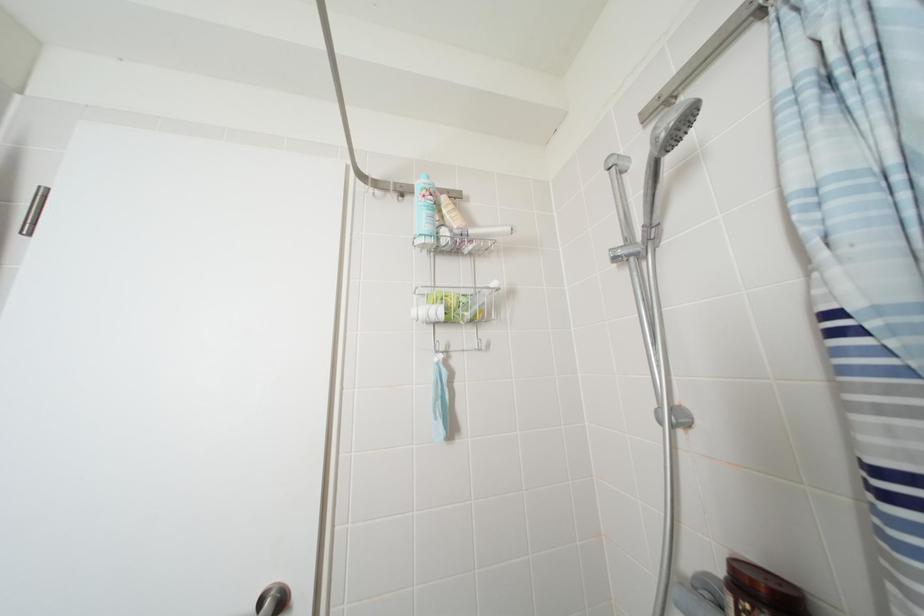
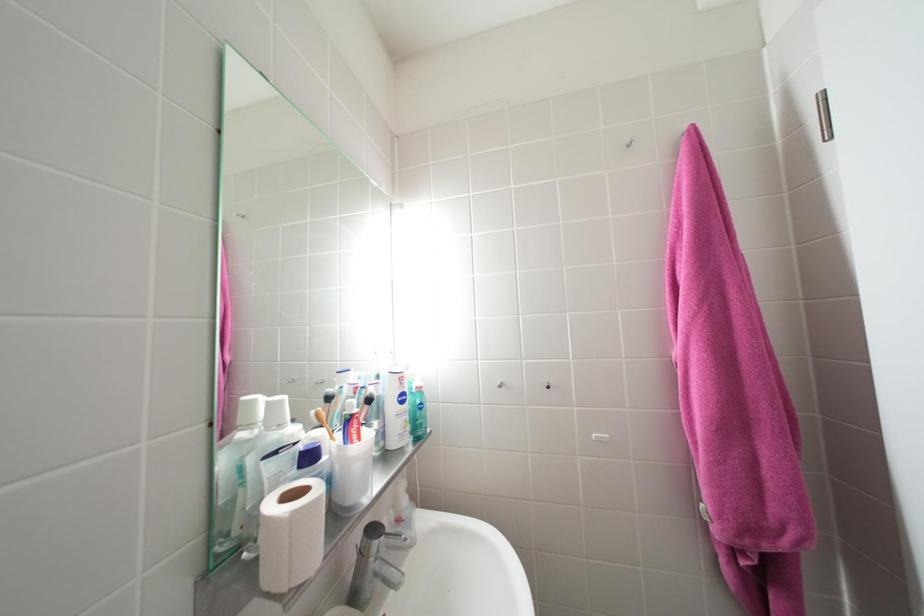
Question: How did the camera likely rotate?

Choices:
 (A) Left
 (B) Right
 (C) Up
 (D) Down

Answer: (A)